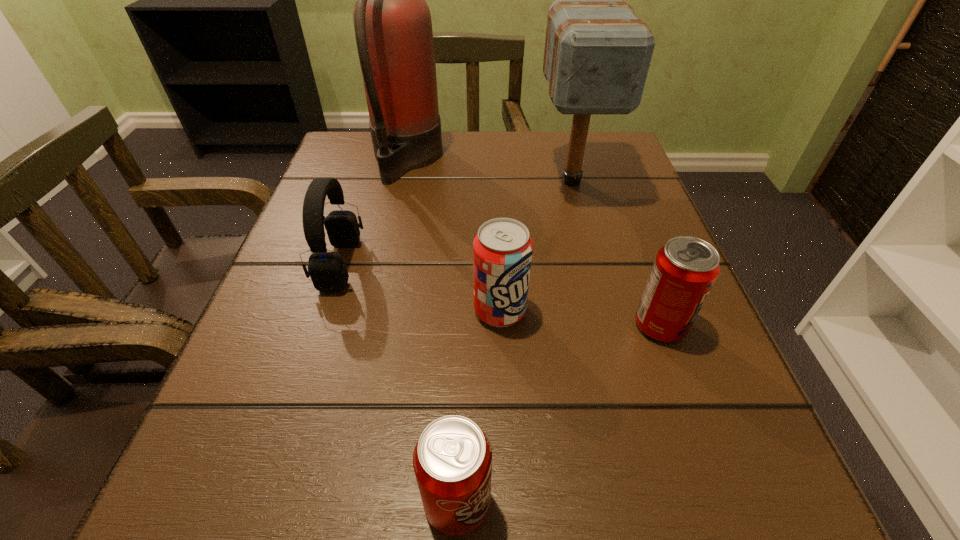
The image size is (960, 540). What are the coordinates of `vacant space that satisfies the following two spatial constraints: 1. on the striking surface of the fifth shortest object; 2. on the left side of the rightmost soda` in the screenshot? It's located at (610, 325).

You are a GUI agent. You are given a task and a screenshot of the screen. Output one action in this format:
    pyautogui.click(x=<x>, y=<y>)
    Task: Click on the free space that satisfies the following two spatial constraints: 1. on the headband of the rightmost soda; 2. on the right side of the headset
    
    Given the screenshot: What is the action you would take?
    pyautogui.click(x=321, y=325)

The width and height of the screenshot is (960, 540). Identify the location of free space that satisfies the following two spatial constraints: 1. on the striking surface of the mallet; 2. on the right side of the rightmost soda. (610, 325).

Where is `vacant region that satisfies the following two spatial constraints: 1. at the nozzle of the fire extinguisher; 2. on the left side of the rightmost soda`? Image resolution: width=960 pixels, height=540 pixels. vacant region that satisfies the following two spatial constraints: 1. at the nozzle of the fire extinguisher; 2. on the left side of the rightmost soda is located at coordinates (370, 325).